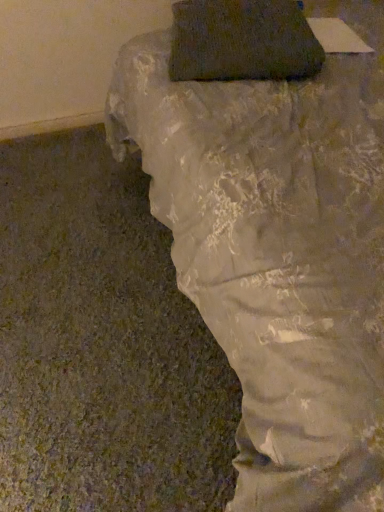
Find the location of a particular element. dark gray fabric pillow at upper center is located at coordinates (242, 41).

What do you see at coordinates (242, 41) in the screenshot? I see `dark gray fabric pillow at upper center` at bounding box center [242, 41].

Measure the distance between point (x=260, y=71) and camera.

Point (x=260, y=71) is 1.06 meters from camera.

The height and width of the screenshot is (512, 384). Find the location of `dark gray fabric pillow at upper center`. dark gray fabric pillow at upper center is located at coordinates (242, 41).